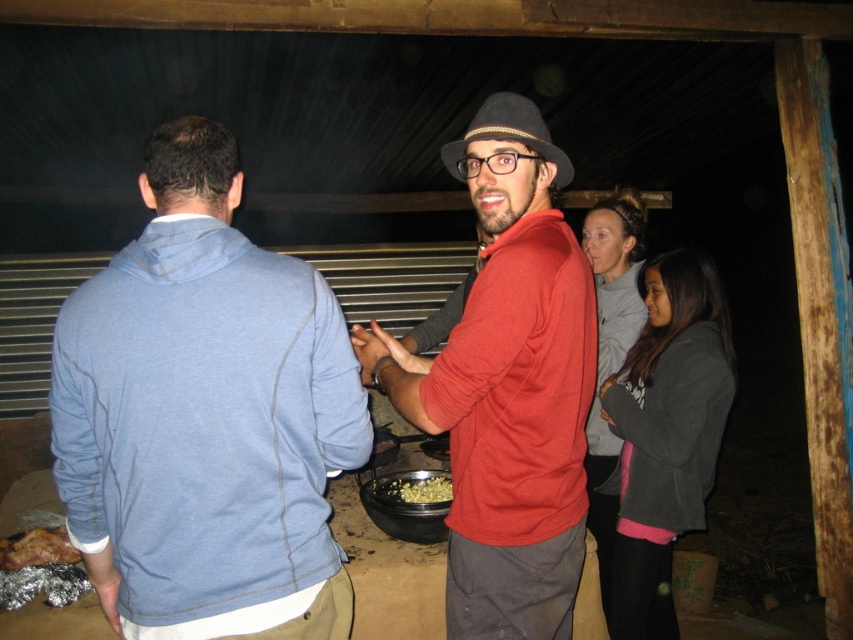
Question: Among these points, which one is nearest to the camera?

Choices:
 (A) (329, 294)
 (B) (718, 300)
 (C) (398, 483)
 (D) (605, 518)

Answer: (A)

Question: Which point is closer to the camera?

Choices:
 (A) (637, 202)
 (B) (13, 547)
 (C) (450, 483)

Answer: (B)

Question: Is blue fleece jacket at center positioned at the back of gray sweatshirt at right?

Choices:
 (A) yes
 (B) no

Answer: (B)

Question: Does blue fleece jacket at center come behind matte red sweater at center?

Choices:
 (A) yes
 (B) no

Answer: (B)

Question: Does blue fleece jacket at center have a smaller size compared to yellow matte popcorn at center?

Choices:
 (A) no
 (B) yes

Answer: (A)

Question: Based on their relative distances, which object is farther from the gray sweatshirt at right?

Choices:
 (A) matte red sweater at center
 (B) shiny silver foil at lower left

Answer: (B)